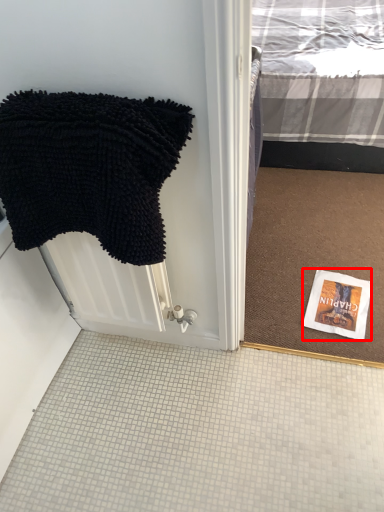
Question: From the image's perspective, considering the relative positions of book cover (annotated by the red box) and towel in the image provided, where is book cover (annotated by the red box) located with respect to the staircase?

Choices:
 (A) below
 (B) above

Answer: (A)